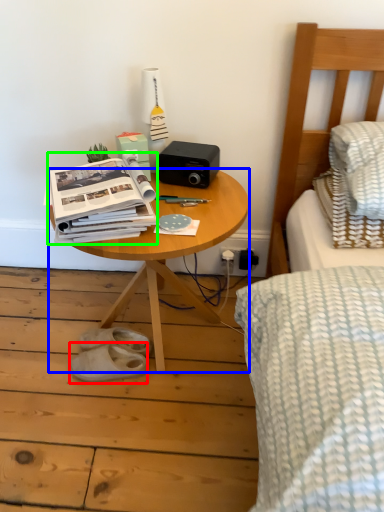
Question: Considering the real-world distances, which object is farthest from footwear (highlighted by a red box)? table (highlighted by a blue box) or paperback book (highlighted by a green box)?

Choices:
 (A) table
 (B) paperback book

Answer: (B)